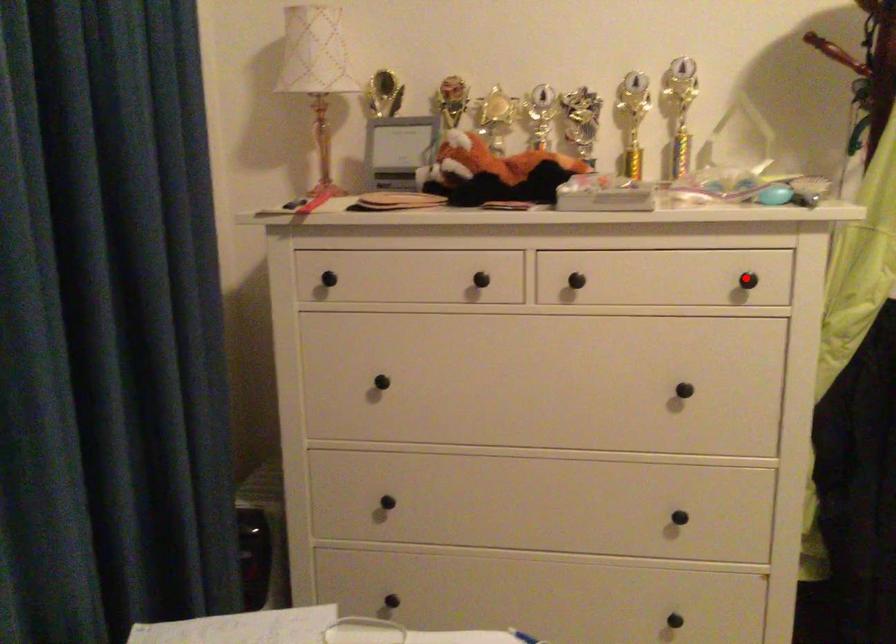
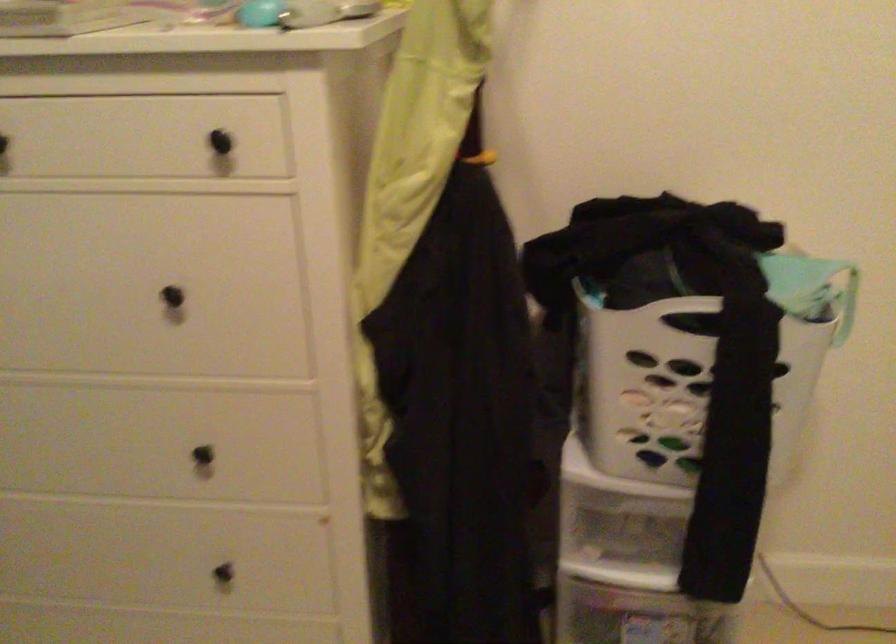
Find the pixel in the second image that matches the highlighted location in the first image.

(220, 142)